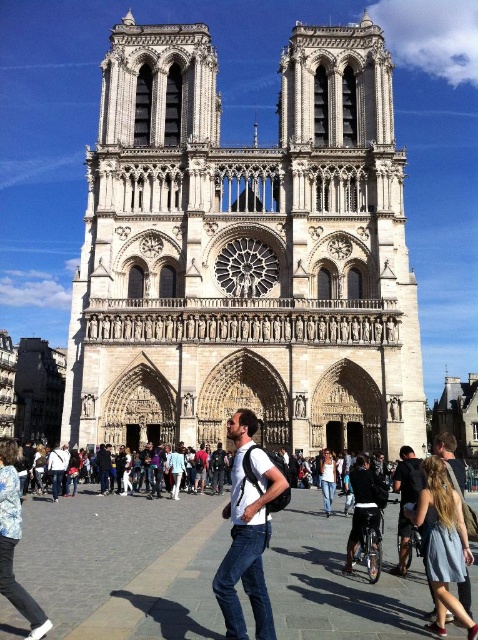
You are a photographer standing in front of Notre Dame Cathedral. You notice a person wearing a white matte shirt at center and another wearing a denim skirt at lower right. Which clothing item is taller?

The white matte shirt at center is taller than the denim skirt at lower right.

You are a photographer standing in front of Notre Dame Cathedral. You see a person wearing a white matte shirt at center and denim jeans at center. Which piece of clothing appears bigger in the photo?

The white matte shirt at center is larger in size than the denim jeans at center, so the white matte shirt at center appears bigger in the photo.